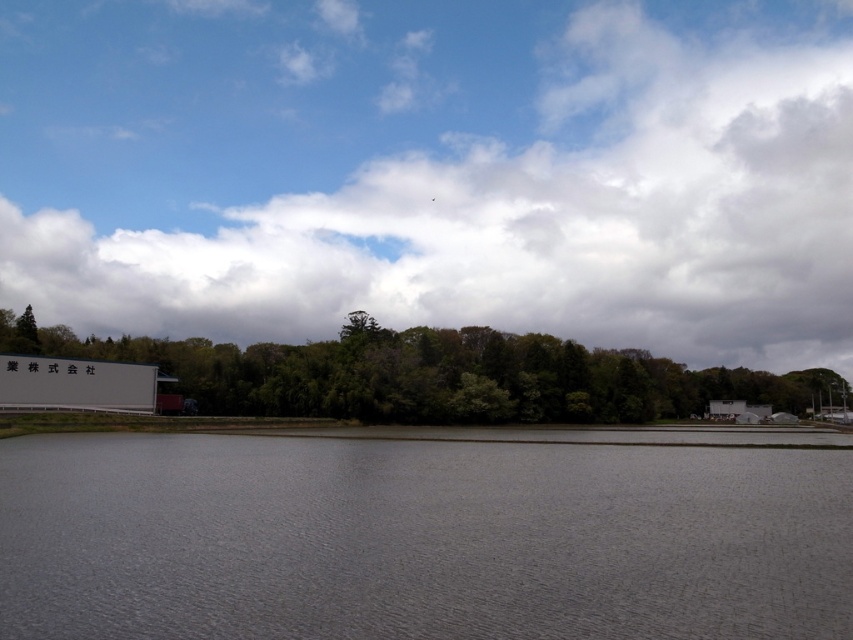
Does white fluffy cloud at upper center come behind green leafy trees at lower center?

Answer: Yes, white fluffy cloud at upper center is further from the viewer.

Who is taller, white fluffy cloud at upper center or green leafy trees at lower center?

Standing taller between the two is white fluffy cloud at upper center.

This screenshot has width=853, height=640. In order to click on white fluffy cloud at upper center in this screenshot , I will do `click(434, 170)`.

Does gray matte water at center have a greater width compared to green leafy trees at lower center?

No, gray matte water at center is not wider than green leafy trees at lower center.

Is point (730, 611) positioned before point (20, 348)?

Yes, it is in front of point (20, 348).

Locate an element on the screen. The image size is (853, 640). gray matte water at center is located at coordinates (419, 540).

Does white fluffy cloud at upper center have a smaller size compared to gray matte water at center?

No, white fluffy cloud at upper center is not smaller than gray matte water at center.

How much distance is there between white fluffy cloud at upper center and gray matte water at center?

white fluffy cloud at upper center is 854.17 feet from gray matte water at center.

Between point (498, 22) and point (230, 547), which one is positioned behind?

Positioned behind is point (498, 22).

At what (x,y) coordinates should I click in order to perform the action: click on white fluffy cloud at upper center. Please return your answer as a coordinate pair (x, y). Looking at the image, I should click on (434, 170).